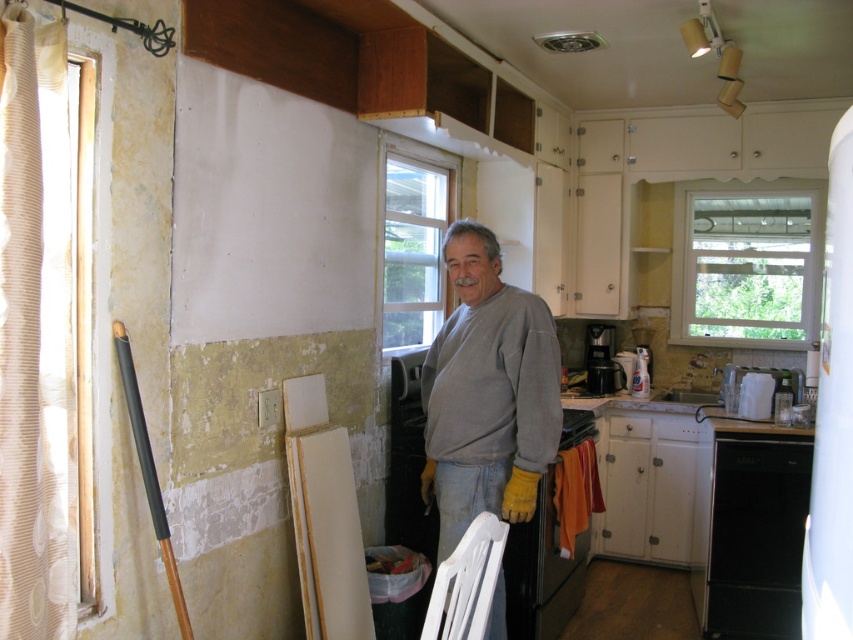
Consider the image. You are a delivery person trying to place a large package in the kitchen. The package requires 5 feet of clearance to maneuver safely. Can you move the package between the gray cotton shirt at center and the black matte dishwasher at lower right without hitting anything?

The distance between the gray cotton shirt at center and the black matte dishwasher at lower right is 4.70 feet. Since the required clearance is 5 feet, the package cannot be safely maneuvered through that space without risking a collision.

Consider the image. You are a contractor assessing the kitchen layout. You need to determine the spatial arrangement between the gray cotton shirt at center and the black matte dishwasher at lower right. Which object is located to the left of the other?

The gray cotton shirt at center is positioned on the left side of black matte dishwasher at lower right, so the gray cotton shirt at center is to the left of the black matte dishwasher at lower right.